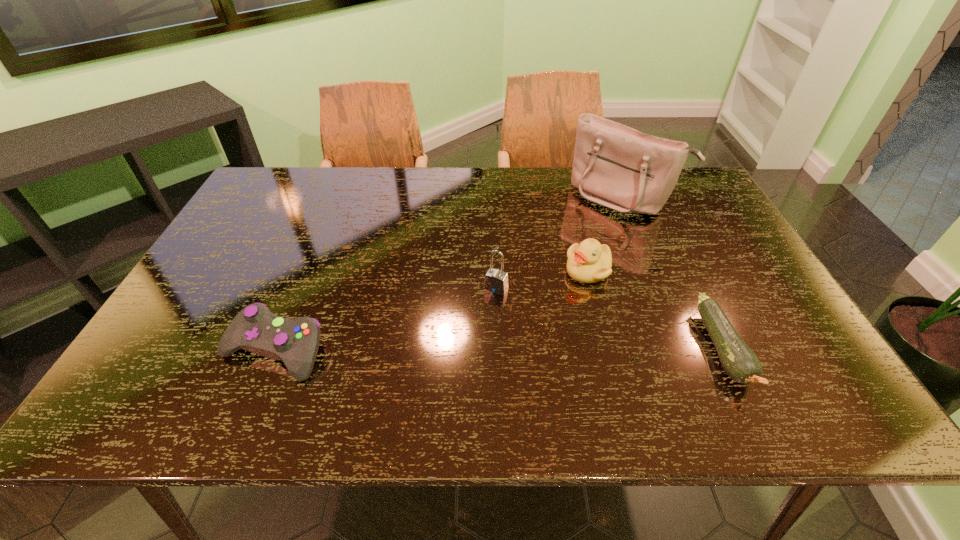
I want to click on free space on the desktop that is between the leftmost object and the shortest object and is positioned on the beak of the third shortest object, so click(551, 349).

Where is `free space on the desktop that is between the second shortest object and the zucchini and is positioned on the shackle of the padlock`? Image resolution: width=960 pixels, height=540 pixels. free space on the desktop that is between the second shortest object and the zucchini and is positioned on the shackle of the padlock is located at coordinates (459, 349).

Locate an element on the screen. This screenshot has height=540, width=960. vacant space on the desktop that is between the control and the zucchini and is positioned on the front pocket of the shoulder bag is located at coordinates (474, 349).